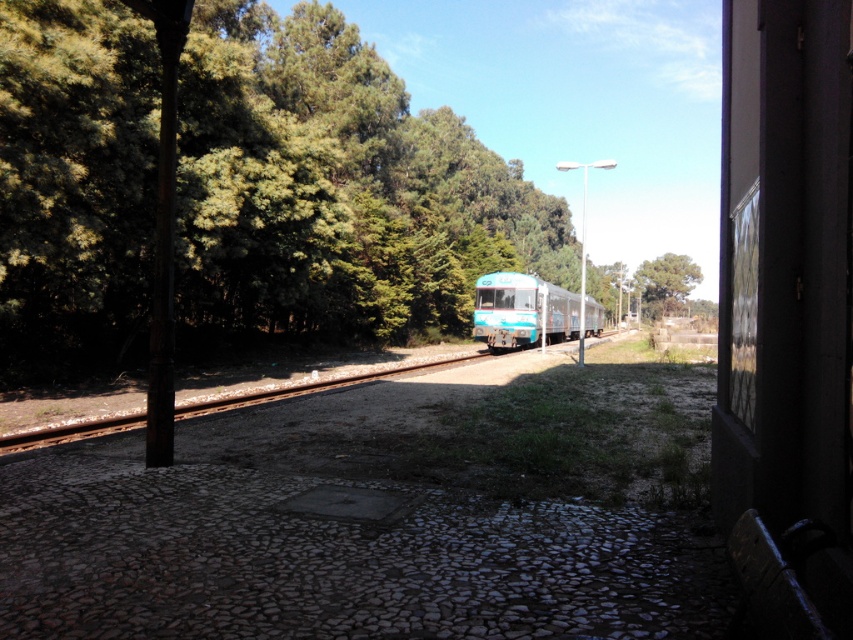
Question: Estimate the real-world distances between objects in this image. Which object is farther from the green leafy trees at upper left?

Choices:
 (A) teal glossy train at center
 (B) green leafy tree at center

Answer: (B)

Question: Can you confirm if green leafy trees at upper left is thinner than green leafy tree at center?

Choices:
 (A) yes
 (B) no

Answer: (B)

Question: Which point is closer to the camera?

Choices:
 (A) (683, 280)
 (B) (508, 288)

Answer: (B)

Question: Which point appears farthest from the camera in this image?

Choices:
 (A) tap(637, 273)
 (B) tap(444, 305)

Answer: (A)

Question: Where is green leafy trees at upper left located in relation to green leafy tree at center in the image?

Choices:
 (A) left
 (B) right

Answer: (A)

Question: Does green leafy trees at upper left have a larger size compared to green leafy tree at center?

Choices:
 (A) yes
 (B) no

Answer: (A)